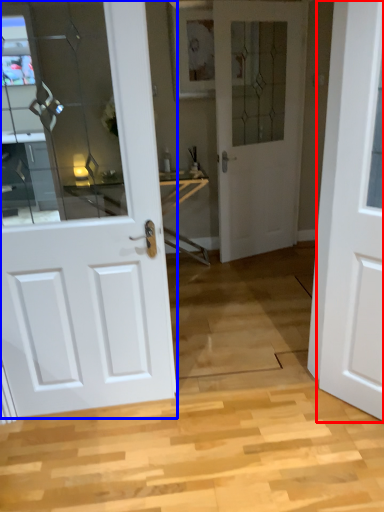
Question: Which point is further to the camera, door (highlighted by a red box) or door (highlighted by a blue box)?

Choices:
 (A) door
 (B) door

Answer: (B)